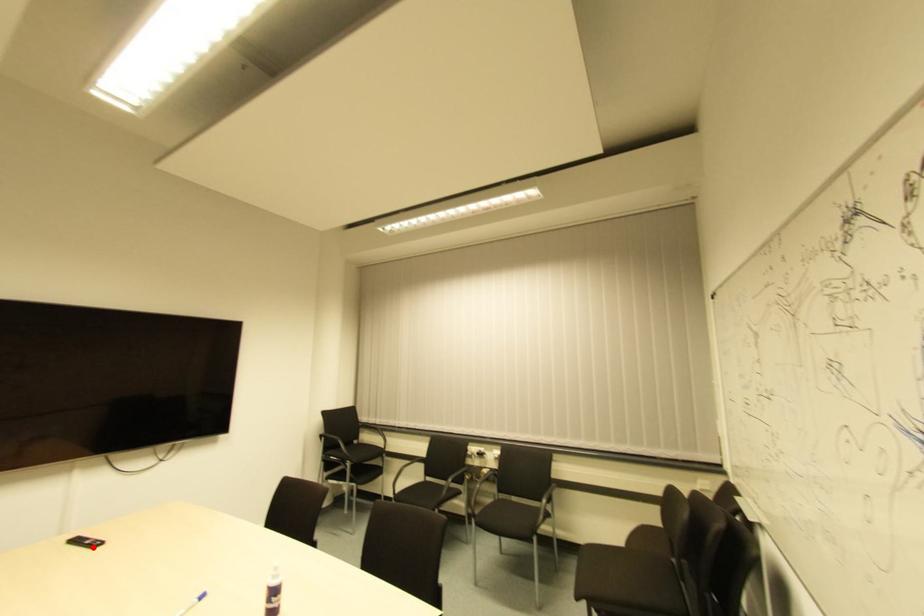
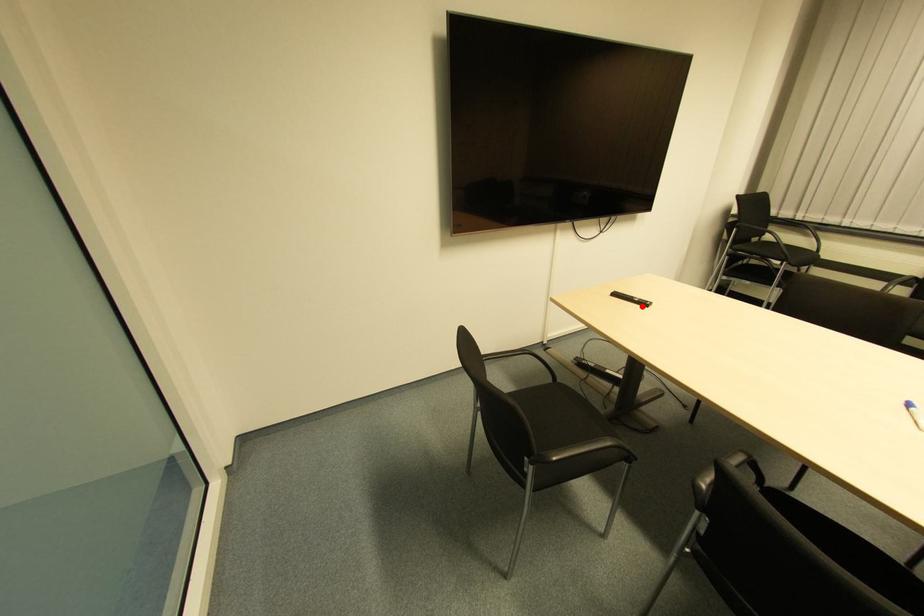
Looking at this image, I am providing you with two images of the same scene from different viewpoints. A red point is marked on the first image and another point is marked on the second image. Is the marked point in image1 the same physical position as the marked point in image2?

Yes